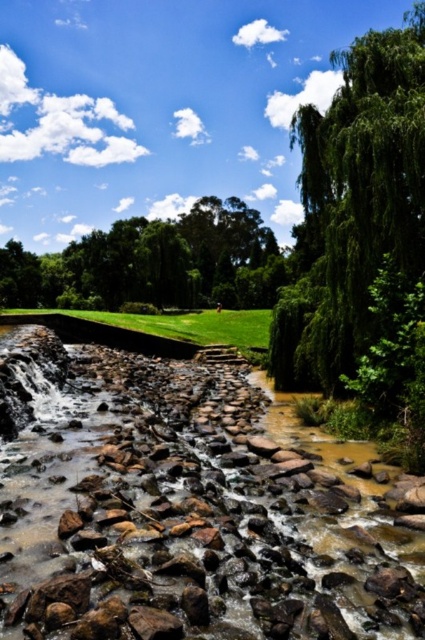
You are standing on the grassy field near the low stone wall and want to cross to the other side. The green leafy tree at center is directly in front of you. Which direction should you walk to avoid the brown rocky creek at center?

To avoid the brown rocky creek at center, you should walk away from the green leafy tree at center since the creek is located below the tree, meaning it is positioned further down the slope or path from the tree. Moving away from the tree would take you away from the creek towards higher ground.

In the serene natural scene with a rocky stream and a grassy area bordered by a stone wall, there is a point marked at coordinates (354, 204). What does this point represent?

The point at coordinates (354, 204) represents the location of the green leafy tree at upper right.

You are standing at the edge of the rocky stream and want to place two markers at the coordinates point (300, 356) and point (172, 330). Which marker will be closer to you?

Point (300, 356) is closer to the viewer than point (172, 330).